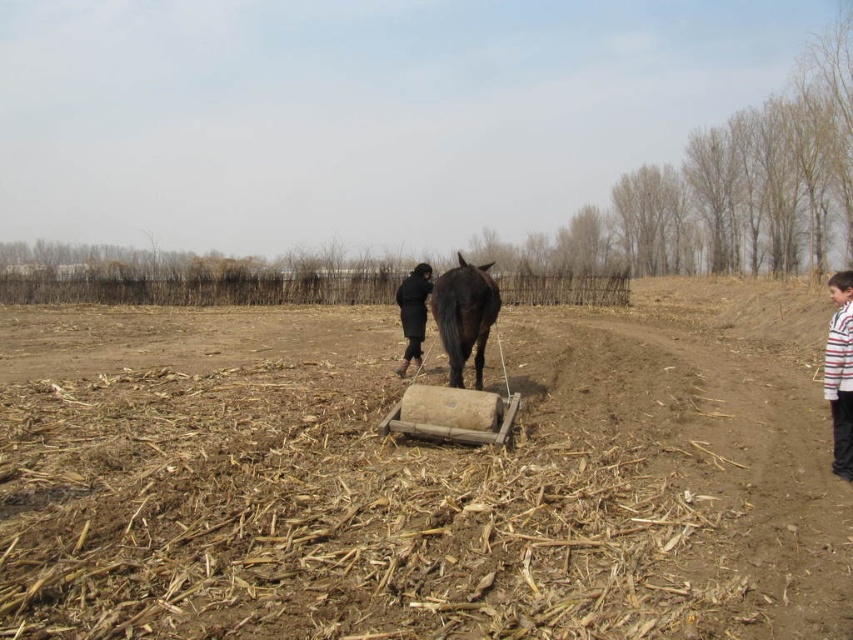
You are a farmer standing at the edge of the dirt path. You need to reach the striped cotton shirt at right to retrieve a tool. The black glossy horse at center is blocking your path. Can you walk around the horse to reach the shirt without disturbing it?

The black glossy horse at center is 4.84 meters away from striped cotton shirt at right. Since the horse is blocking your path, you can walk around it as there is sufficient space between the horse and the shirt to navigate around without disturbing it.